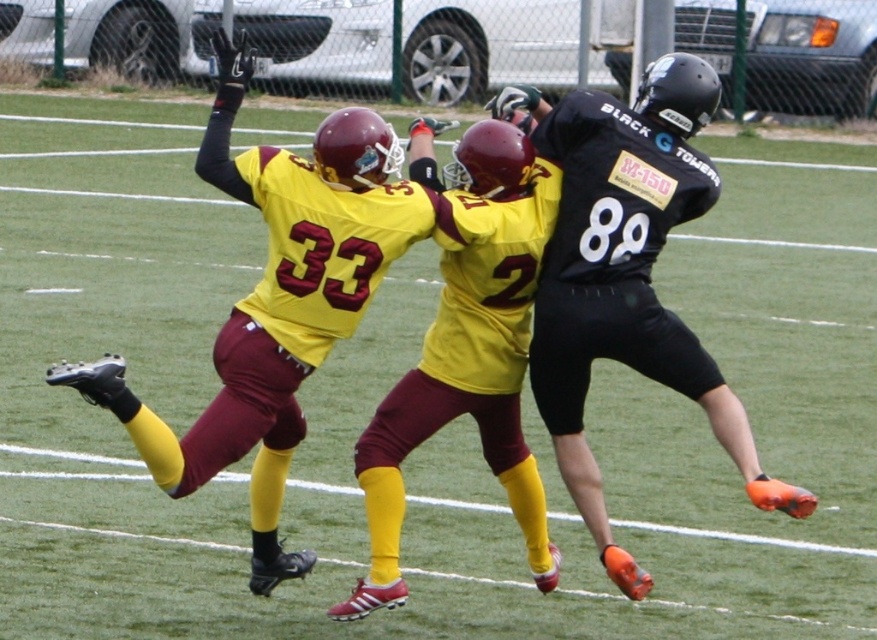
You are a sports analyst watching the game. You notice two players at the center of the field wearing black matte jersey at center and maroon jersey at center. Based on their positions, which one is positioned more to the right side of the field?

The black matte jersey at center is positioned to the right of the maroon jersey at center, so the black matte jersey at center is more to the right side of the field.

From the picture: You are a referee standing at the sideline observing the game. You need to determine if the two players wearing black matte jersey at center and maroon jersey at center are within the required 20 inches for a legal tackle. Can you confirm if they are within the distance?

The black matte jersey at center and maroon jersey at center are 19.66 inches apart, which is within the required 20 inches for a legal tackle.

In the scene shown: You are a referee observing the game. You notice two players wearing the black matte jersey at center and maroon jersey at center. According to the rules, only players with jerseys wider than 12 inches can participate in the tackle zone. Can both players participate?

The black matte jersey at center might be wider than maroon jersey at center, but without exact measurements, it is unclear if either meets the 12 inch requirement. Further measurement is needed.